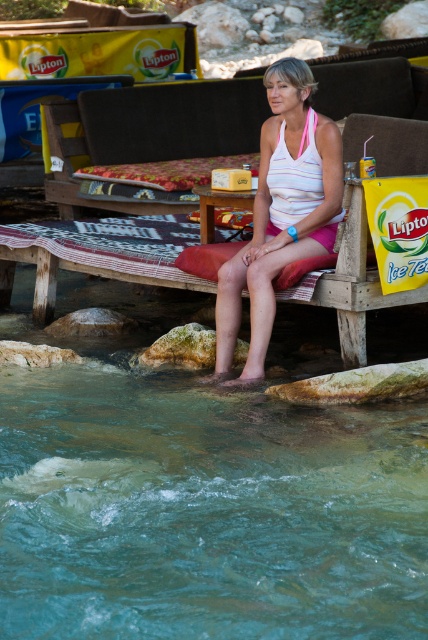
Question: Which object is positioned closest to the wooden park bench at center?

Choices:
 (A) clear water at feet lower
 (B) wooden picnic table at center
 (C) white striped tank top at center

Answer: (B)

Question: Is clear water at feet lower below white striped tank top at center?

Choices:
 (A) no
 (B) yes

Answer: (B)

Question: Does clear water at feet lower appear over white striped tank top at center?

Choices:
 (A) yes
 (B) no

Answer: (B)

Question: Which point is farther to the camera?

Choices:
 (A) (39, 604)
 (B) (297, 221)
 (C) (231, 198)

Answer: (C)

Question: Based on their relative distances, which object is nearer to the clear water at feet lower?

Choices:
 (A) wooden park bench at center
 (B) wooden picnic table at center
 (C) white striped tank top at center

Answer: (C)

Question: Can you confirm if clear water at feet lower is thinner than wooden picnic table at center?

Choices:
 (A) yes
 (B) no

Answer: (B)